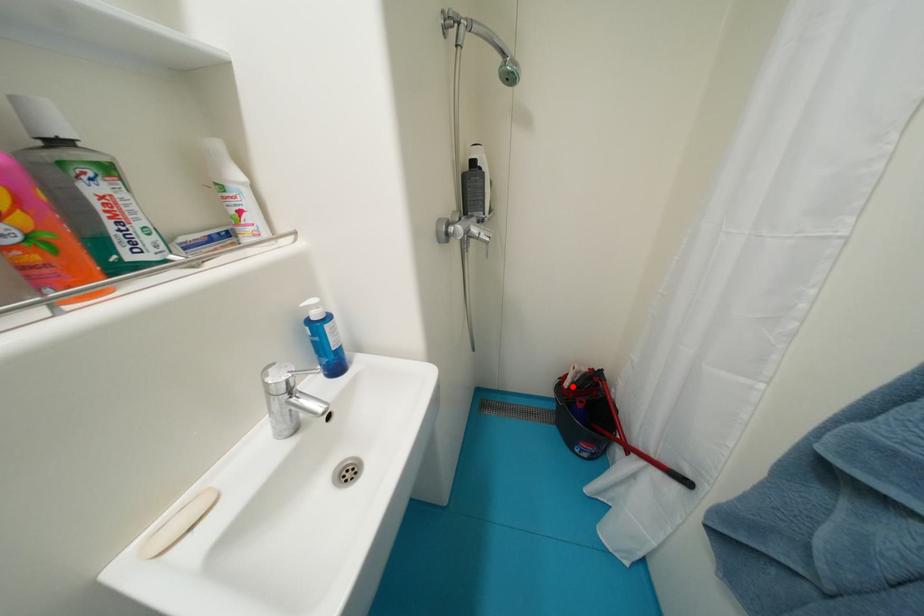
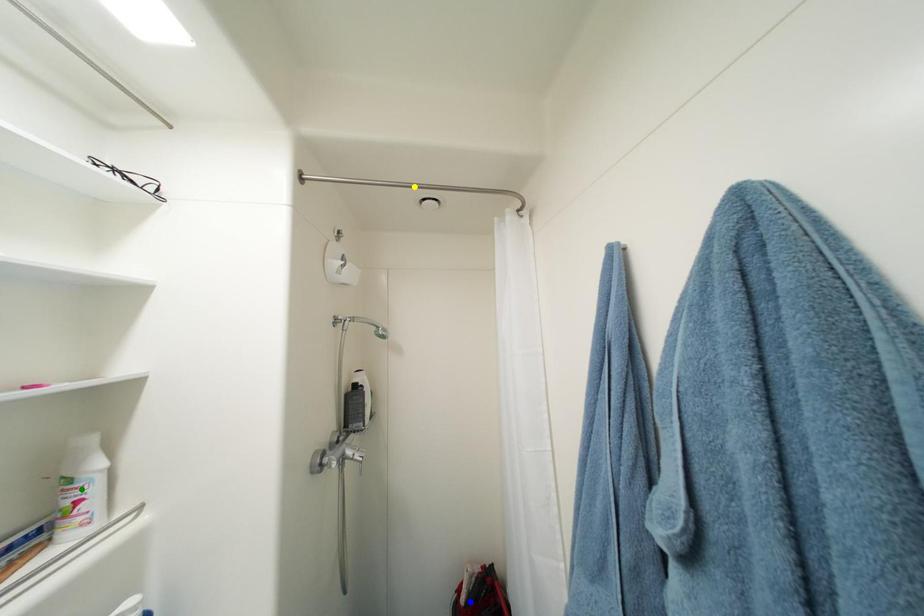
Question: I am providing you with two images of the same scene from different viewpoints. A red point is marked on the first image. You are given multiple points on the second image. Which point in image 2 is actually the same real-world point as the red point in image 1?

Choices:
 (A) yellow point
 (B) blue point
 (C) green point

Answer: (B)